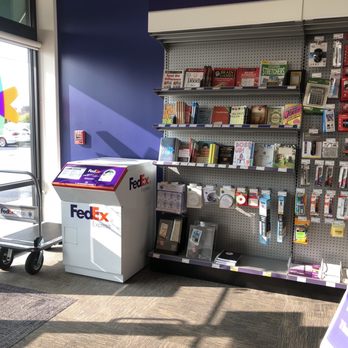
The image size is (348, 348). In order to click on book in this screenshot , I will do `click(242, 151)`.